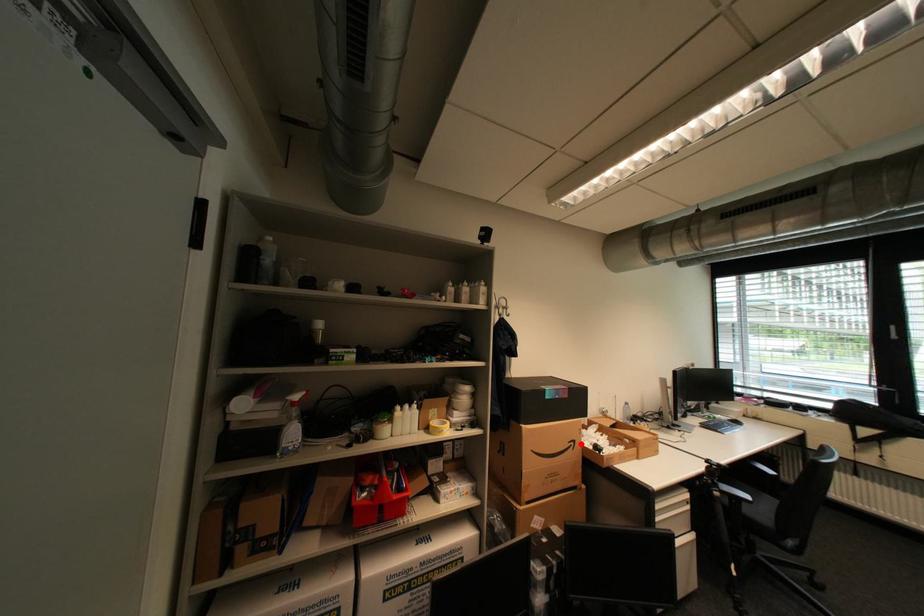
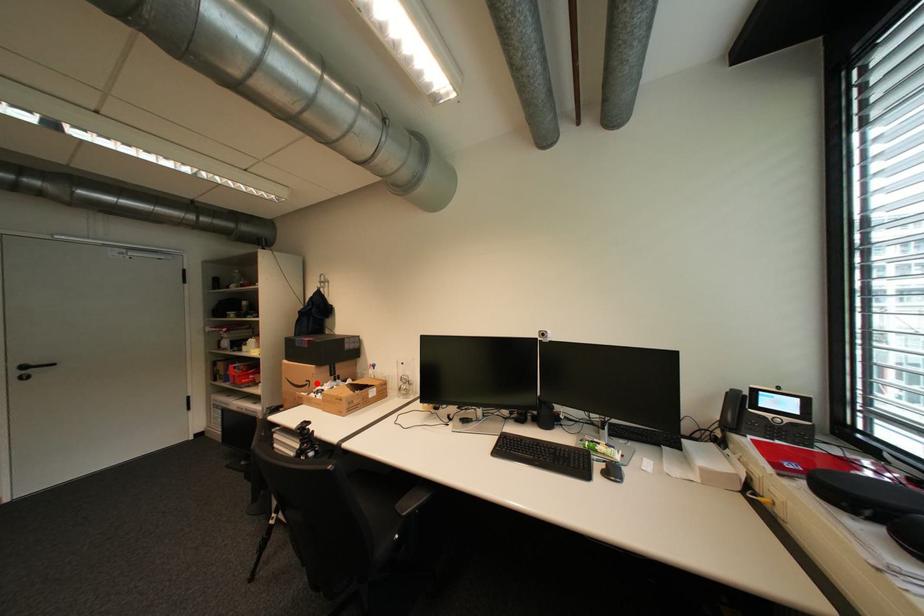
I am providing you with two images of the same scene from different viewpoints. A red point is marked on the first image and another point is marked on the second image. Is the marked point in image1 the same physical position as the marked point in image2?

Yes